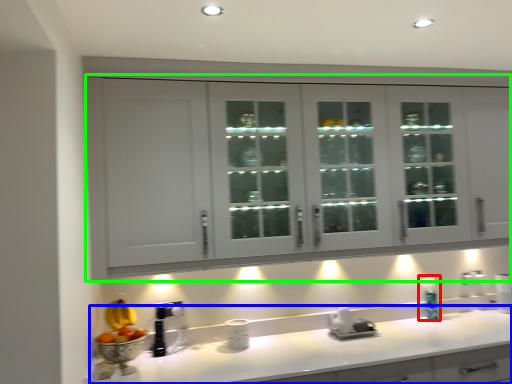
Question: Considering the real-world distances, which object is closest to soap dispenser (highlighted by a red box)? countertop (highlighted by a blue box) or cabinetry (highlighted by a green box).

Choices:
 (A) countertop
 (B) cabinetry

Answer: (A)